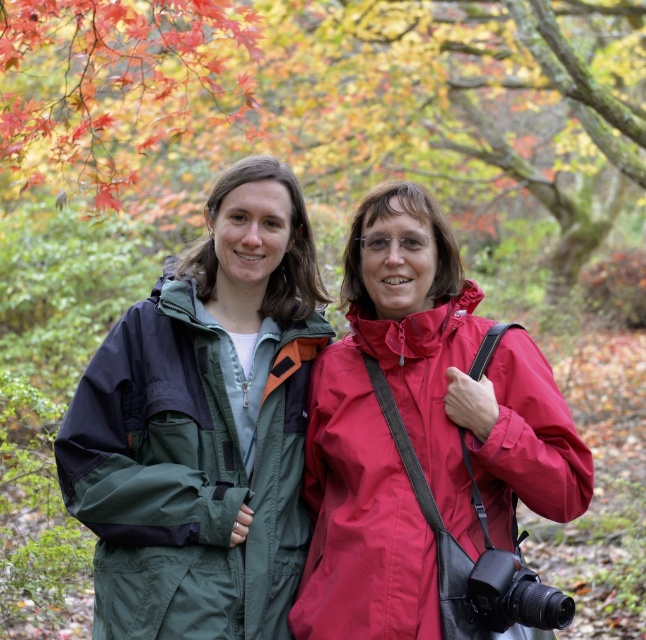
You are standing in the autumn scene and want to place a small decorative rock between the two points labeled as point (514, 552) and point (194, 556). Since the rock can only be placed on the ground, which point should you choose to ensure it stays visible and not blocked by the other?

You should place the rock at point (514, 552) because it is in front of point (194, 556), so it will remain visible and not blocked by the other point.

You are a photographer trying to capture a closeup of the matte red jacket at center and the green fabric jacket at center. Which jacket should you focus on first if you want to ensure both are in focus without moving the camera?

The matte red jacket at center is above the green fabric jacket at center, so you should focus on the green fabric jacket at center first since it is closer to the camera. This way, the depth of field will likely include both jackets in focus.

You are planning to take a photo of both the matte red jacket at center and the green fabric jacket at center. Since you want to ensure both are clearly visible, which jacket should you focus on first to account for their sizes?

The matte red jacket at center is larger than the green fabric jacket at center, so you should focus on the matte red jacket at center first to ensure it is in clear focus before adjusting for the smaller one.